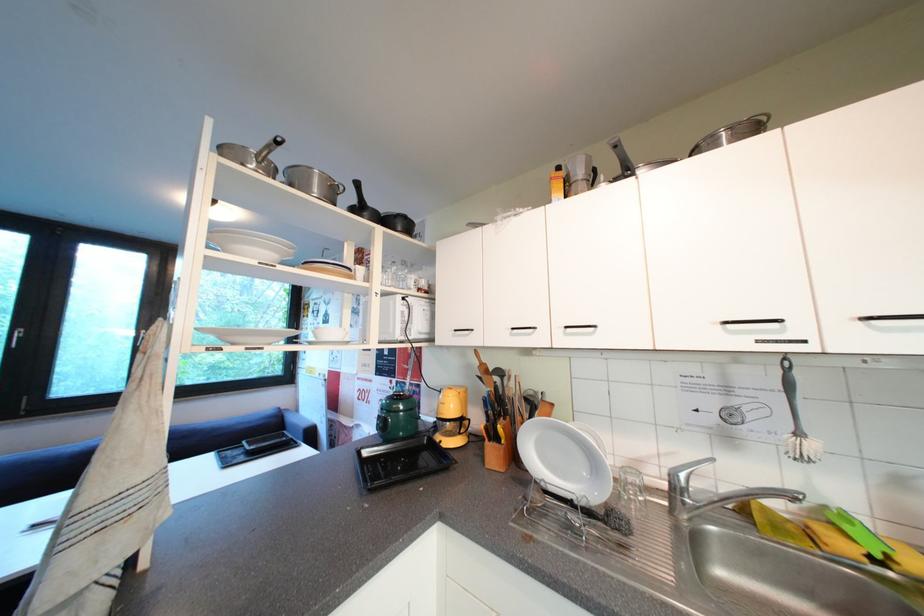
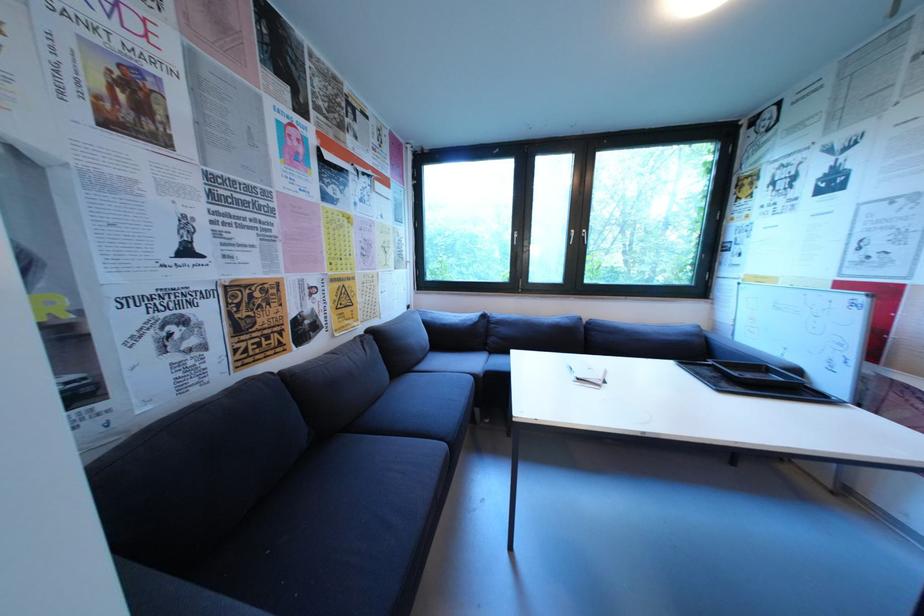
In the second image, find the point that corresponds to [43,528] in the first image.

(586, 381)